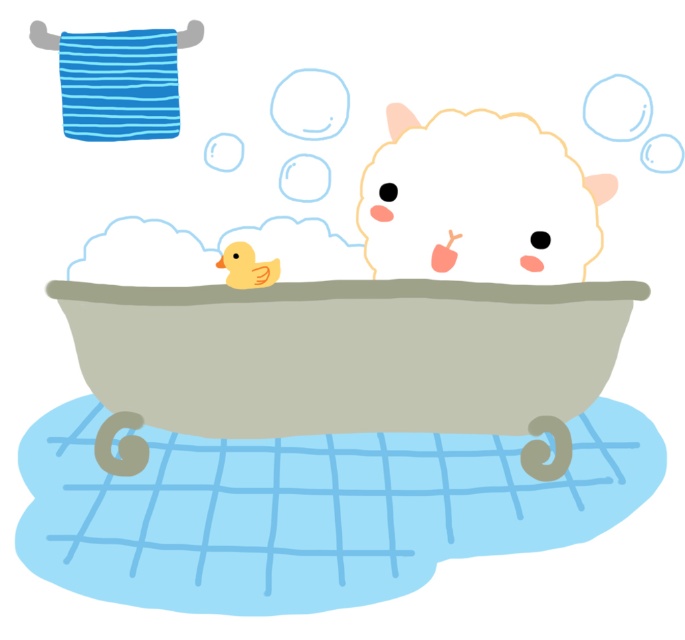
Question: Does matte gray bathtub at center have a lesser width compared to yellow rubber duck at center?

Choices:
 (A) no
 (B) yes

Answer: (A)

Question: Considering the real-world distances, which object is farthest from the yellow rubber duck at center?

Choices:
 (A) matte gray bathtub at center
 (B) fluffy white animal at upper center

Answer: (B)

Question: Which object appears farthest from the camera in this image?

Choices:
 (A) yellow rubber duck at center
 (B) matte gray bathtub at center

Answer: (A)

Question: Does fluffy white animal at upper center appear under yellow rubber duck at center?

Choices:
 (A) no
 (B) yes

Answer: (A)

Question: Which is farther from the yellow rubber duck at center?

Choices:
 (A) fluffy white animal at upper center
 (B) matte gray bathtub at center

Answer: (A)

Question: Is fluffy white animal at upper center further to camera compared to yellow rubber duck at center?

Choices:
 (A) yes
 (B) no

Answer: (A)